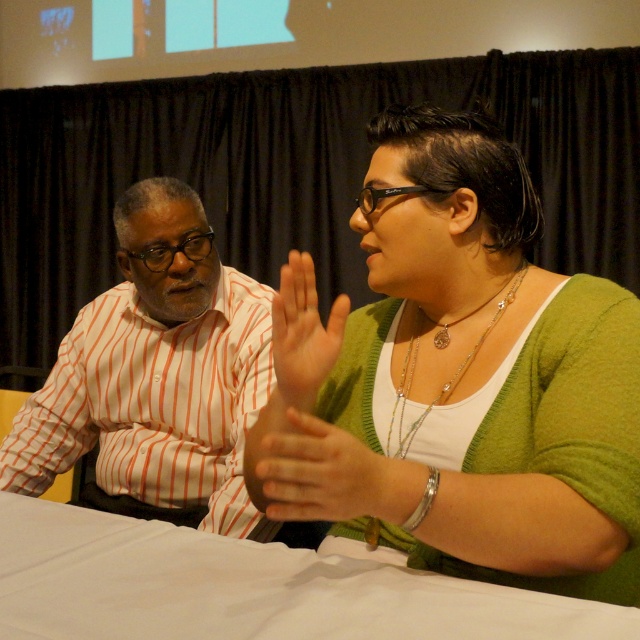
Between green matte sweater at upper right and silver/glassy layered necklace at upper center, which one appears on the right side from the viewer's perspective?

silver/glassy layered necklace at upper center is more to the right.

Who is positioned more to the left, green matte sweater at upper right or silver/glassy layered necklace at upper center?

From the viewer's perspective, green matte sweater at upper right appears more on the left side.

Who is more forward, [545,387] or [449,380]?

Point [545,387]

In order to click on green matte sweater at upper right in this screenshot , I will do `click(460, 380)`.

Is matte skin palm at center below silver/glassy layered necklace at upper center?

Actually, matte skin palm at center is above silver/glassy layered necklace at upper center.

Who is lower down, matte skin palm at center or silver/glassy layered necklace at upper center?

silver/glassy layered necklace at upper center

Identify the location of matte skin palm at center. (301, 337).

Is striped cotton shirt at left wider than white cloth at lower center?

In fact, striped cotton shirt at left might be narrower than white cloth at lower center.

Looking at this image, who is more distant from viewer, [147,323] or [360,564]?

The point [147,323] is behind.

Who is more forward, (211, 308) or (99, 625)?

Positioned in front is point (99, 625).

I want to click on striped cotton shirt at left, so click(156, 376).